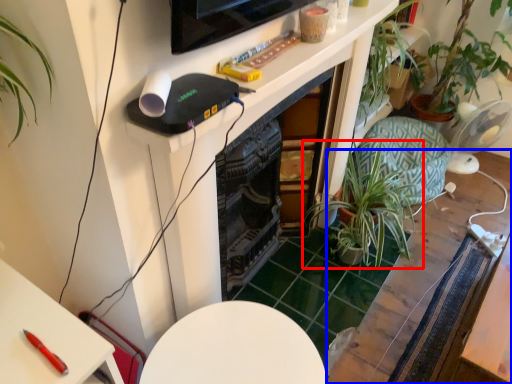
Question: Which object is further to the camera taking this photo, houseplant (highlighted by a red box) or table (highlighted by a blue box)?

Choices:
 (A) houseplant
 (B) table

Answer: (A)